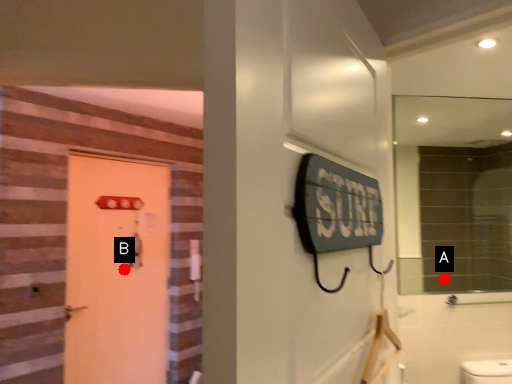
Question: Two points are circled on the image, labeled by A and B beside each circle. Which point appears farthest from the camera in this image?

Choices:
 (A) A is further
 (B) B is further

Answer: (A)